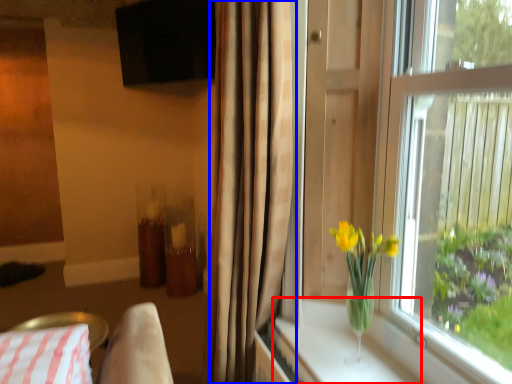
Question: Which object is further to the camera taking this photo, window sill (highlighted by a red box) or curtain (highlighted by a blue box)?

Choices:
 (A) window sill
 (B) curtain

Answer: (A)